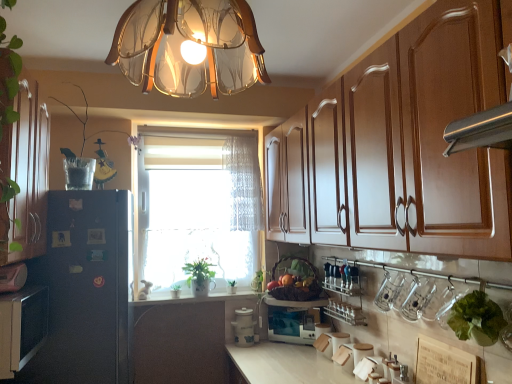
Identify the location of vacant space that is in between green leafy plant at window, which is counted as the second plant, starting from the left, and green leafy plant at window, arranged as the 2th plant when viewed from the right. The image size is (512, 384). (205, 295).